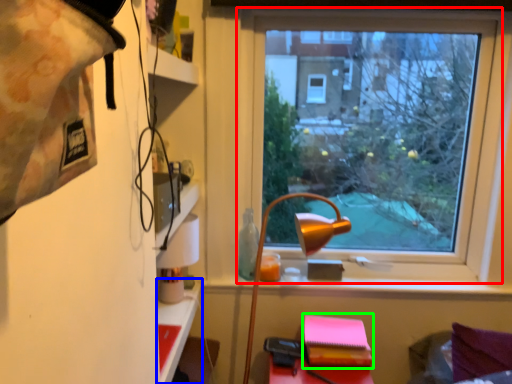
Question: Estimate the real-world distances between objects in this image. Which object is closer to window (highlighted by a red box), table (highlighted by a blue box) or notebook (highlighted by a green box)?

Choices:
 (A) table
 (B) notebook

Answer: (B)